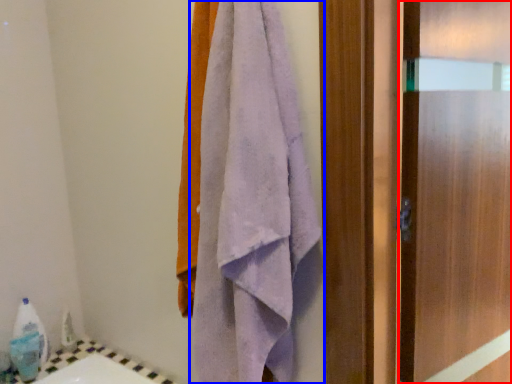
Question: Which object appears closest to the camera in this image, screen door (highlighted by a red box) or towel (highlighted by a blue box)?

Choices:
 (A) screen door
 (B) towel

Answer: (B)